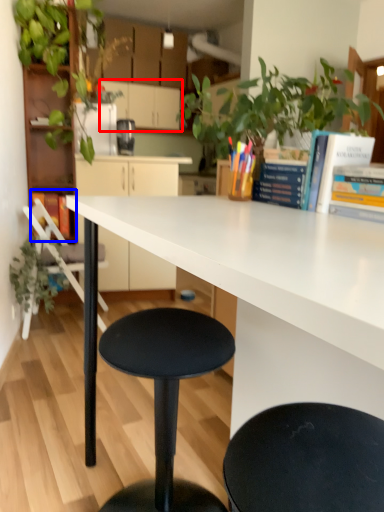
Question: Which object is closer to the camera taking this photo, cabinetry (highlighted by a red box) or book (highlighted by a blue box)?

Choices:
 (A) cabinetry
 (B) book

Answer: (B)